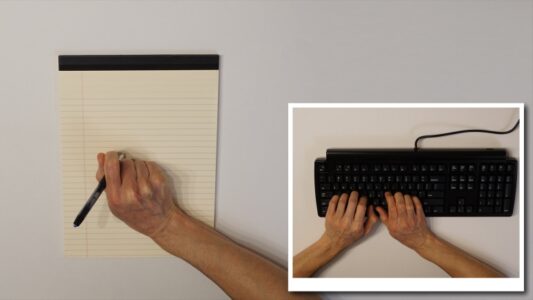
Where is `black cord`? The image size is (533, 300). black cord is located at coordinates (477, 130).